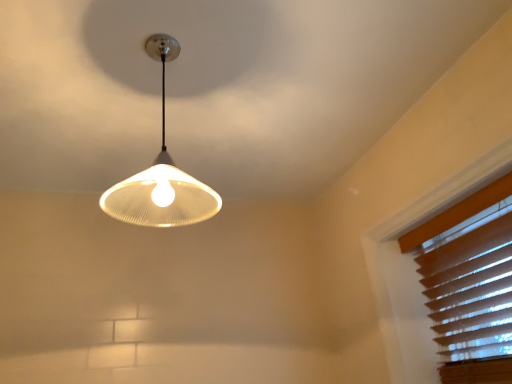
Question: Does brown wood blinds at upper right have a larger size compared to white matte lampshade at upper center?

Choices:
 (A) yes
 (B) no

Answer: (B)

Question: Does brown wood blinds at upper right have a smaller size compared to white matte lampshade at upper center?

Choices:
 (A) no
 (B) yes

Answer: (B)

Question: From the image's perspective, is brown wood blinds at upper right located above white matte lampshade at upper center?

Choices:
 (A) yes
 (B) no

Answer: (B)

Question: Is brown wood blinds at upper right aimed at white matte lampshade at upper center?

Choices:
 (A) no
 (B) yes

Answer: (B)

Question: Are brown wood blinds at upper right and white matte lampshade at upper center located far from each other?

Choices:
 (A) yes
 (B) no

Answer: (B)

Question: Is brown wood blinds at upper right wider than white matte lampshade at upper center?

Choices:
 (A) yes
 (B) no

Answer: (B)

Question: Is brown wood blinds at upper right located within white matte lampshade at upper center?

Choices:
 (A) yes
 (B) no

Answer: (B)

Question: Is white matte lampshade at upper center bigger than brown wood blinds at upper right?

Choices:
 (A) no
 (B) yes

Answer: (B)

Question: Is white matte lampshade at upper center placed right next to brown wood blinds at upper right?

Choices:
 (A) yes
 (B) no

Answer: (B)

Question: Is white matte lampshade at upper center not close to brown wood blinds at upper right?

Choices:
 (A) yes
 (B) no

Answer: (B)

Question: Is white matte lampshade at upper center positioned in front of brown wood blinds at upper right?

Choices:
 (A) no
 (B) yes

Answer: (B)

Question: Is white matte lampshade at upper center oriented away from brown wood blinds at upper right?

Choices:
 (A) no
 (B) yes

Answer: (A)

Question: From the image's perspective, is white matte lampshade at upper center above or below brown wood blinds at upper right?

Choices:
 (A) above
 (B) below

Answer: (A)